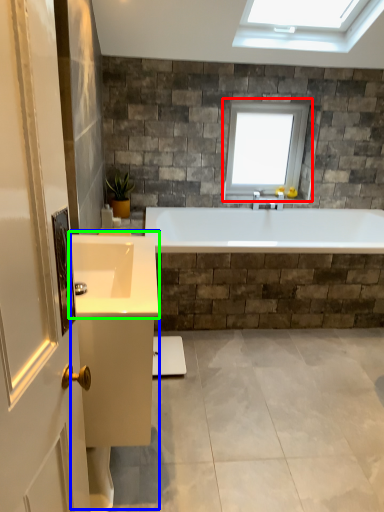
Question: Which object is positioned farthest from window (highlighted by a red box)? Select from vanity (highlighted by a blue box) and sink (highlighted by a green box).

Choices:
 (A) vanity
 (B) sink

Answer: (A)